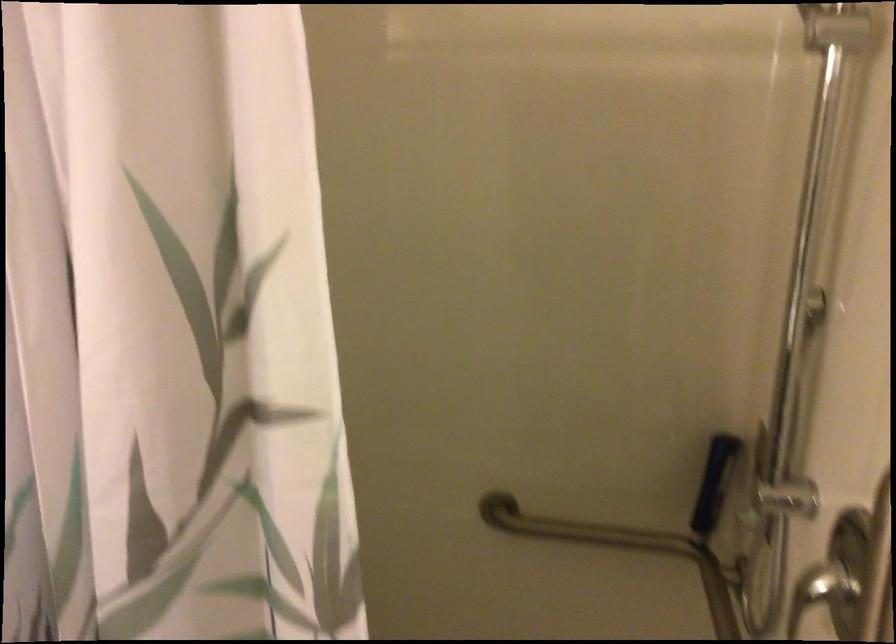
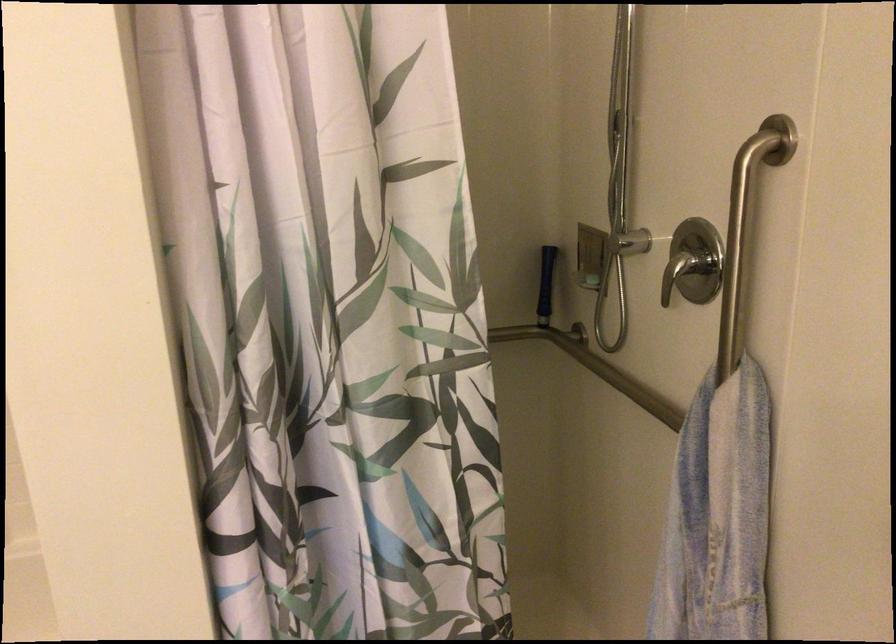
In the second image, find the point that corresponds to point 707,498 in the first image.

(546, 285)